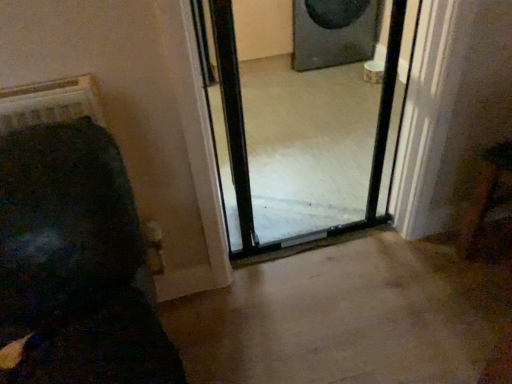
Locate an element on the screen. This screenshot has width=512, height=384. black matte speaker at upper center is located at coordinates (333, 32).

What do you see at coordinates (333, 32) in the screenshot? I see `black matte speaker at upper center` at bounding box center [333, 32].

Image resolution: width=512 pixels, height=384 pixels. Describe the element at coordinates (304, 122) in the screenshot. I see `clear glass screen door at center` at that location.

This screenshot has height=384, width=512. Find the location of `clear glass screen door at center`. clear glass screen door at center is located at coordinates [304, 122].

Measure the distance between clear glass screen door at center and camera.

They are 1.11 meters apart.

At what (x,y) coordinates should I click in order to perform the action: click on black matte speaker at upper center. Please return your answer as a coordinate pair (x, y). Looking at the image, I should click on (333, 32).

Between clear glass screen door at center and black matte speaker at upper center, which one appears on the left side from the viewer's perspective?

Positioned to the left is clear glass screen door at center.

Relative to black matte speaker at upper center, is clear glass screen door at center in front or behind?

Visually, clear glass screen door at center is located in front of black matte speaker at upper center.

Considering the positions of points (360, 166) and (360, 1), is point (360, 166) closer to camera compared to point (360, 1)?

Yes.

From the image's perspective, is clear glass screen door at center on black matte speaker at upper center?

No, from the image's perspective, clear glass screen door at center is not above black matte speaker at upper center.

From a real-world perspective, is clear glass screen door at center above or below black matte speaker at upper center?

From a real-world perspective, clear glass screen door at center is physically above black matte speaker at upper center.

Is clear glass screen door at center wider or thinner than black matte speaker at upper center?

Clearly, clear glass screen door at center has less width compared to black matte speaker at upper center.

Considering the sizes of objects clear glass screen door at center and black matte speaker at upper center in the image provided, who is taller, clear glass screen door at center or black matte speaker at upper center?

clear glass screen door at center is taller.

Between clear glass screen door at center and black matte speaker at upper center, which one has smaller size?

clear glass screen door at center.

Is black matte speaker at upper center located within clear glass screen door at center?

That's incorrect, black matte speaker at upper center is not inside clear glass screen door at center.

Are clear glass screen door at center and black matte speaker at upper center far apart?

No, clear glass screen door at center is not far away from black matte speaker at upper center.

Looking at this image, is clear glass screen door at center looking in the opposite direction of black matte speaker at upper center?

No, clear glass screen door at center's orientation is not away from black matte speaker at upper center.

How different are the orientations of clear glass screen door at center and black matte speaker at upper center in degrees?

179 degrees.

At what (x,y) coordinates should I click in order to perform the action: click on screen door that appears in front of the black matte speaker at upper center. Please return your answer as a coordinate pair (x, y). The width and height of the screenshot is (512, 384). Looking at the image, I should click on (304, 122).

Considering the positions of objects black matte speaker at upper center and clear glass screen door at center in the image provided, who is more to the right, black matte speaker at upper center or clear glass screen door at center?

From the viewer's perspective, black matte speaker at upper center appears more on the right side.

Who is more distant, black matte speaker at upper center or clear glass screen door at center?

black matte speaker at upper center is behind.

Between point (323, 5) and point (262, 117), which one is positioned behind?

The point (323, 5) is farther from the camera.

From the image's perspective, between black matte speaker at upper center and clear glass screen door at center, who is located below?

clear glass screen door at center appears lower in the image.

From a real-world perspective, which object rests below the other?

In real-world perspective, black matte speaker at upper center is lower.

Considering the sizes of objects black matte speaker at upper center and clear glass screen door at center in the image provided, who is thinner, black matte speaker at upper center or clear glass screen door at center?

Thinner between the two is clear glass screen door at center.

Considering the sizes of objects black matte speaker at upper center and clear glass screen door at center in the image provided, who is shorter, black matte speaker at upper center or clear glass screen door at center?

black matte speaker at upper center.

Looking at the image, does black matte speaker at upper center seem bigger or smaller compared to clear glass screen door at center?

Considering their sizes, black matte speaker at upper center takes up more space than clear glass screen door at center.

Is clear glass screen door at center completely or partially inside black matte speaker at upper center?

No.

Is black matte speaker at upper center not near clear glass screen door at center?

No, there isn't a large distance between black matte speaker at upper center and clear glass screen door at center.

Is black matte speaker at upper center oriented away from clear glass screen door at center?

That's not correct — black matte speaker at upper center is not looking away from clear glass screen door at center.

Can you tell me how much black matte speaker at upper center and clear glass screen door at center differ in facing direction?

179 degrees separate the facing orientations of black matte speaker at upper center and clear glass screen door at center.

How far apart are black matte speaker at upper center and clear glass screen door at center?

The distance of black matte speaker at upper center from clear glass screen door at center is 18.46 inches.

Where is `screen door on the left of black matte speaker at upper center`? Image resolution: width=512 pixels, height=384 pixels. screen door on the left of black matte speaker at upper center is located at coordinates (304, 122).

Locate an element on the screen. screen door that appears below the black matte speaker at upper center (from the image's perspective) is located at coordinates (304, 122).

Image resolution: width=512 pixels, height=384 pixels. I want to click on screen door located in front of the black matte speaker at upper center, so click(x=304, y=122).